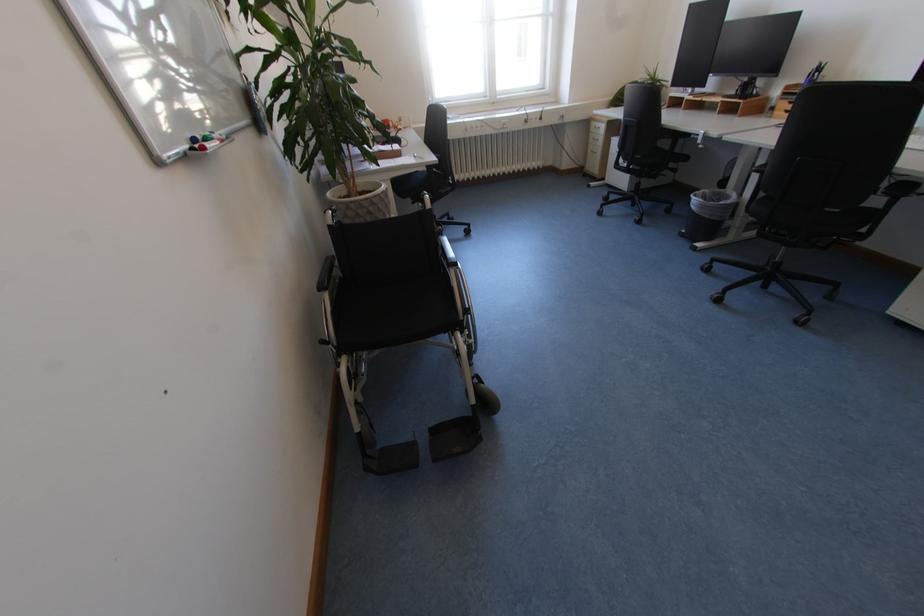
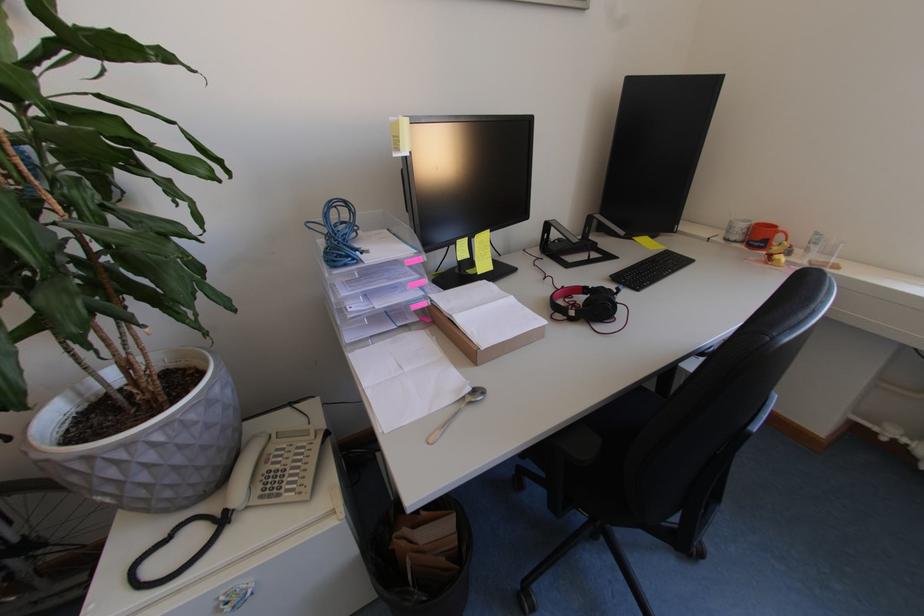
In the second image, find the point that corresponds to point 408,126 in the first image.

(816, 253)